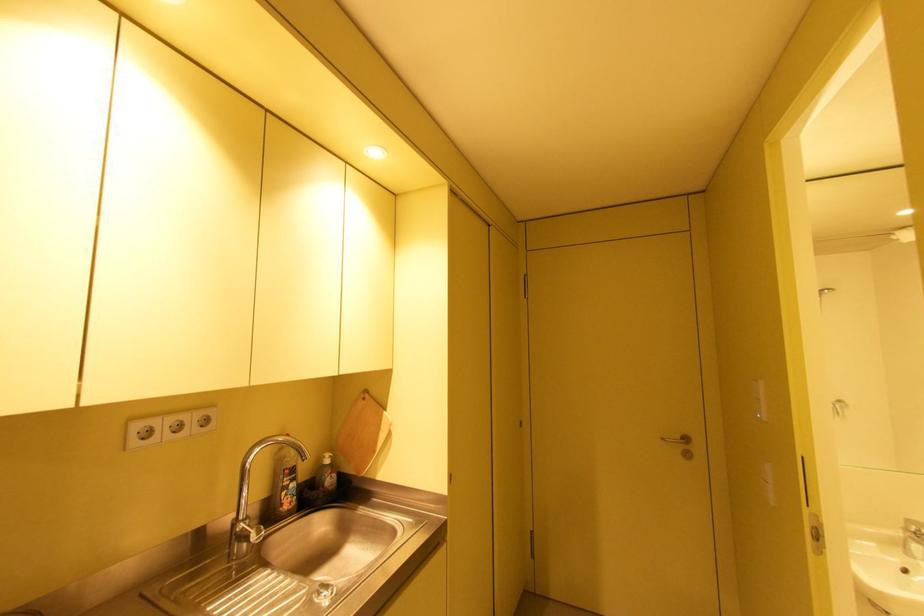
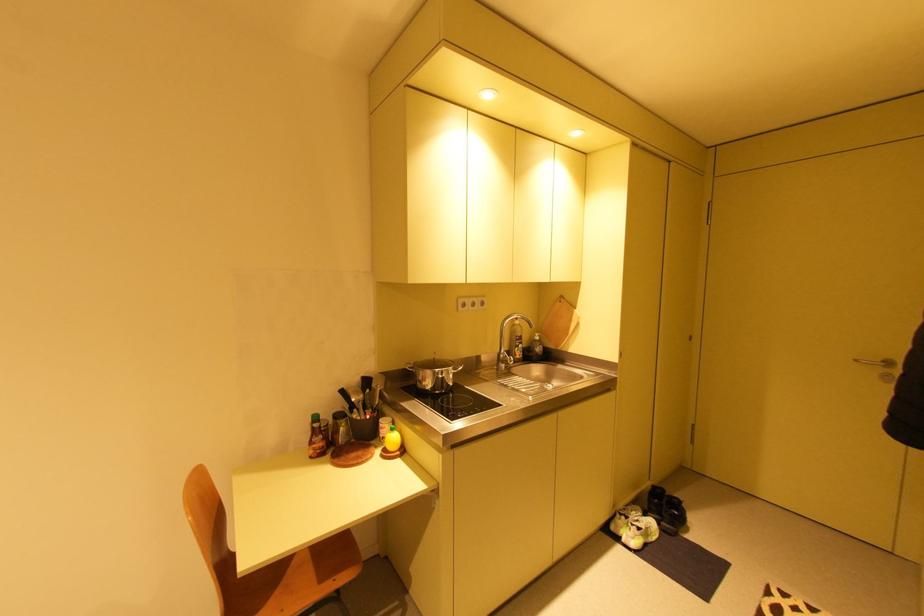
In the second image, find the point that corresponds to point 329,462 in the first image.

(541, 339)